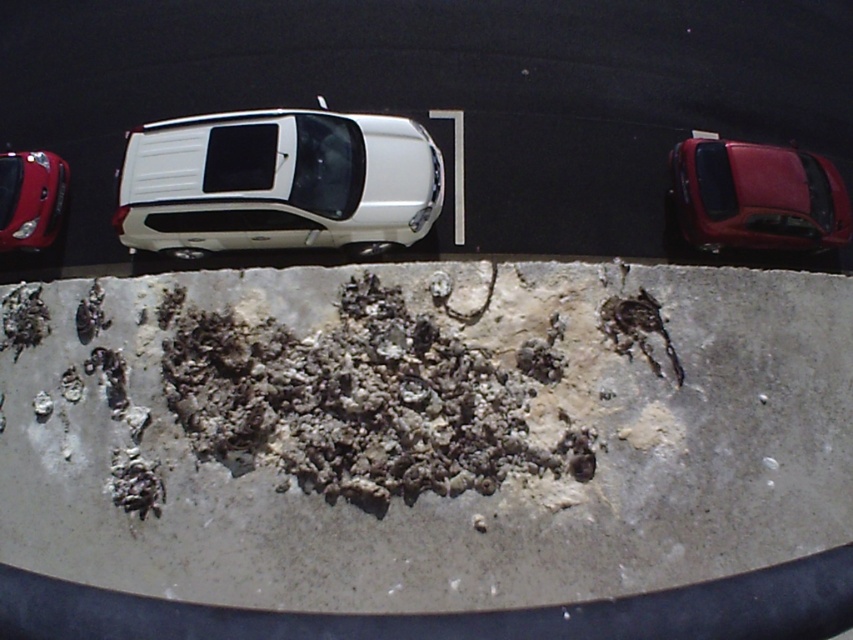
Question: Among these objects, which one is nearest to the camera?

Choices:
 (A) gray rough concrete at center
 (B) shiny red car at left
 (C) glossy red car at right

Answer: (A)

Question: Is glossy red car at right positioned in front of shiny red car at left?

Choices:
 (A) yes
 (B) no

Answer: (A)

Question: Which object is the farthest from the white matte truck at center?

Choices:
 (A) gray rough concrete at center
 (B) glossy red car at right

Answer: (B)

Question: Is gray rough concrete at center above glossy red car at right?

Choices:
 (A) no
 (B) yes

Answer: (A)

Question: Is gray rough concrete at center thinner than shiny red car at left?

Choices:
 (A) no
 (B) yes

Answer: (A)

Question: Which of these objects is positioned closest to the shiny red car at left?

Choices:
 (A) white matte truck at center
 (B) gray rough concrete at center

Answer: (A)